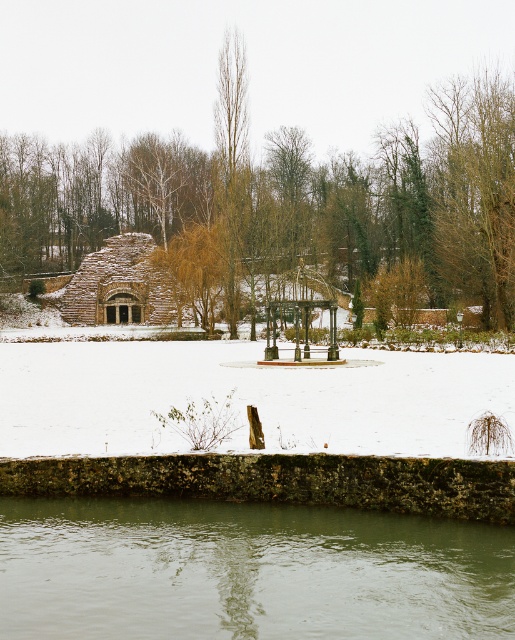
You are planning to install a new lighting system for the winter scene. You have two options for the light fixtures. One is designed to be placed at the base of the bare wood tree at center, and the other is to be mounted on the wooden gazebo at center. Which location would allow the light to reach higher above the ground?

The bare wood tree at center has a greater height compared to the wooden gazebo at center, so placing the light at the base of the bare wood tree at center would allow the light to reach higher above the ground.

You are standing at the center of the circular paved area in front of the rustic stone structure. You want to walk directly towards the greenish water at lower center. What are the coordinates of the point you should aim for?

The coordinates of the point you should aim for are 0.894 in the x direction and 0.480 in the y direction, as the greenish water at lower center is located at point [247,572].

You are standing in the snowy landscape and want to reach the rustic stone hut at center. There is greenish water at lower center in your path. Is the water blocking your way to the hut?

The greenish water at lower center is positioned under rustic stone hut at center, so the water is located beneath the hut and does not block your path to the rustic stone hut at center.